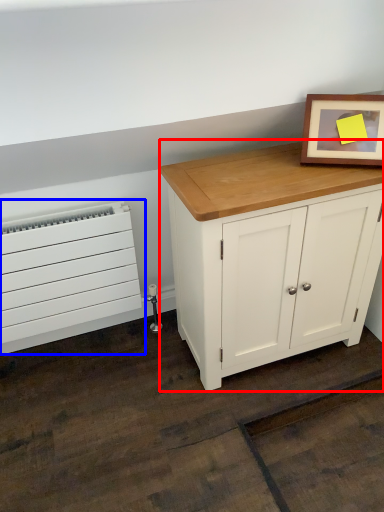
Question: Among these objects, which one is farthest to the camera, chest of drawers (highlighted by a red box) or heater (highlighted by a blue box)?

Choices:
 (A) chest of drawers
 (B) heater

Answer: (B)